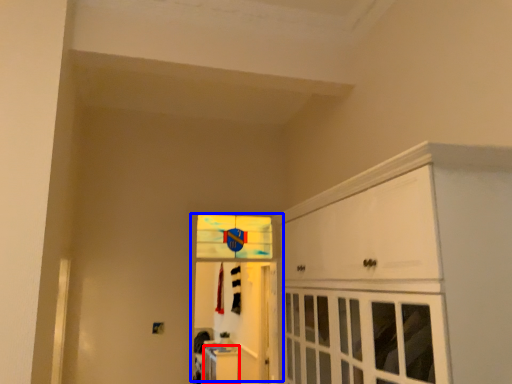
Question: Which object appears closest to the camera in this image, cabinetry (highlighted by a red box) or door (highlighted by a blue box)?

Choices:
 (A) cabinetry
 (B) door

Answer: (B)